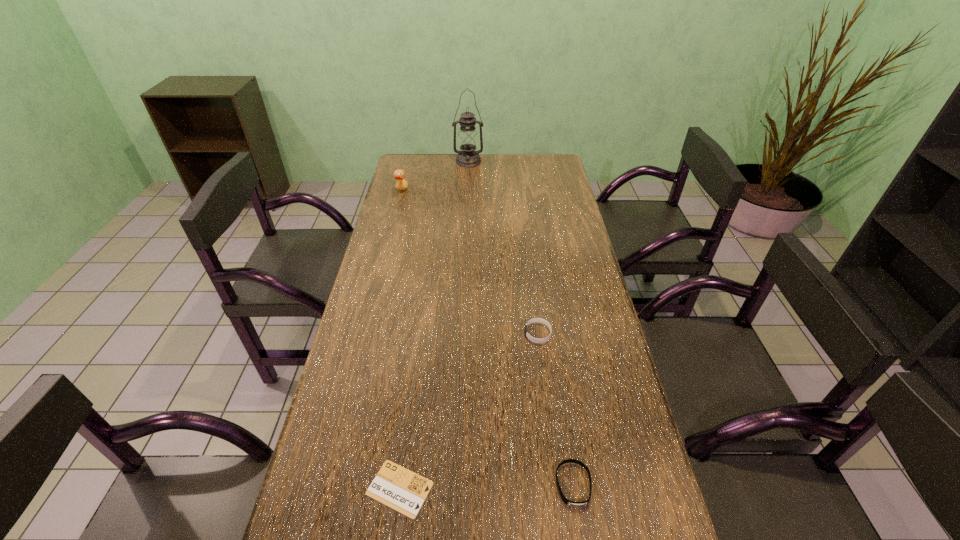
Find the location of `vacant space that is in between the leftmost object and the taller wristband`. vacant space that is in between the leftmost object and the taller wristband is located at coordinates (469, 262).

This screenshot has height=540, width=960. Find the location of `free spot between the taller wristband and the shorter wristband`. free spot between the taller wristband and the shorter wristband is located at coordinates (556, 409).

The height and width of the screenshot is (540, 960). I want to click on free space between the second farthest object and the identity card, so click(400, 340).

Identify which object is located as the nearest to the oil lamp. Please provide its 2D coordinates. Your answer should be formatted as a tuple, i.e. [(x, y)], where the tuple contains the x and y coordinates of a point satisfying the conditions above.

[(399, 175)]

Select which object appears as the third closest to the fourth nearest object. Please provide its 2D coordinates. Your answer should be formatted as a tuple, i.e. [(x, y)], where the tuple contains the x and y coordinates of a point satisfying the conditions above.

[(395, 486)]

The image size is (960, 540). What are the coordinates of `vacant space that satisfies the following two spatial constraints: 1. on the beak of the identity card; 2. on the left side of the fourth nearest object` in the screenshot? It's located at (327, 489).

Find the location of a particular element. This screenshot has width=960, height=540. vacant space that satisfies the following two spatial constraints: 1. on the back side of the oil lamp; 2. on the left side of the identity card is located at coordinates (443, 161).